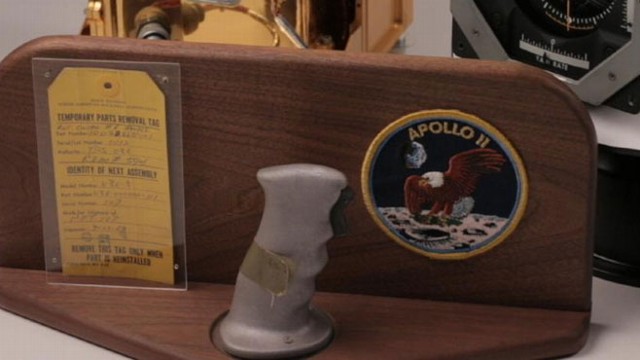
Identify the location of either wall or empty space. This screenshot has height=360, width=640. (429, 27).